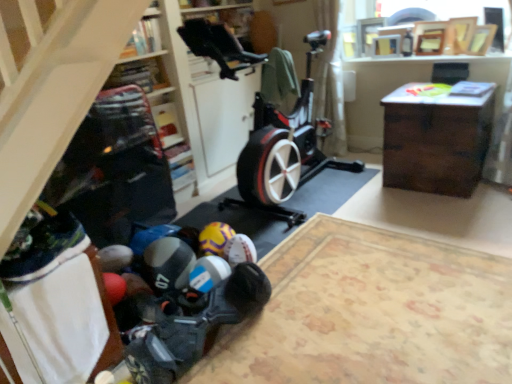
This screenshot has height=384, width=512. I want to click on free space below rubberized black mat at lower left (from a real-world perspective), so click(382, 314).